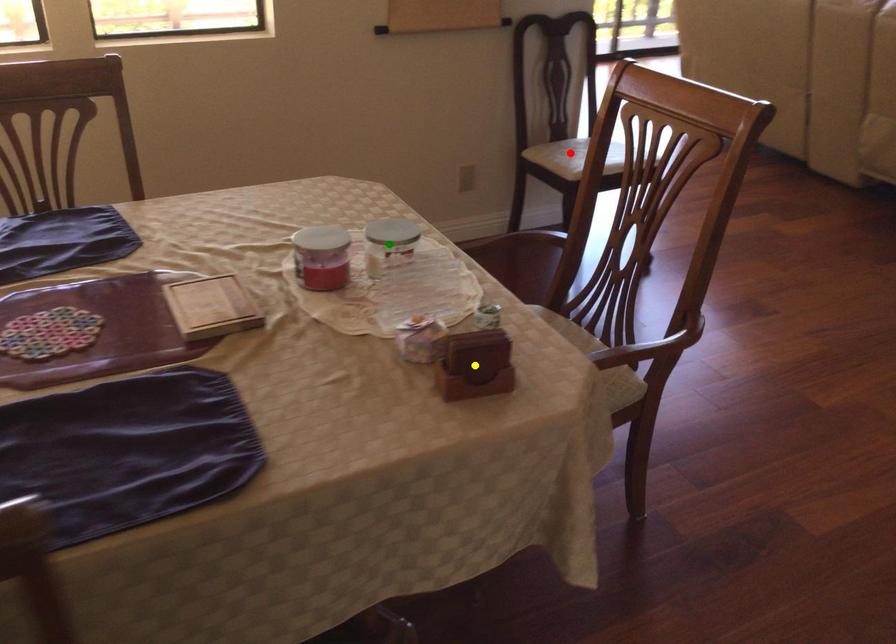
Order these from nearest to farthest:
red point, green point, yellow point

1. red point
2. green point
3. yellow point